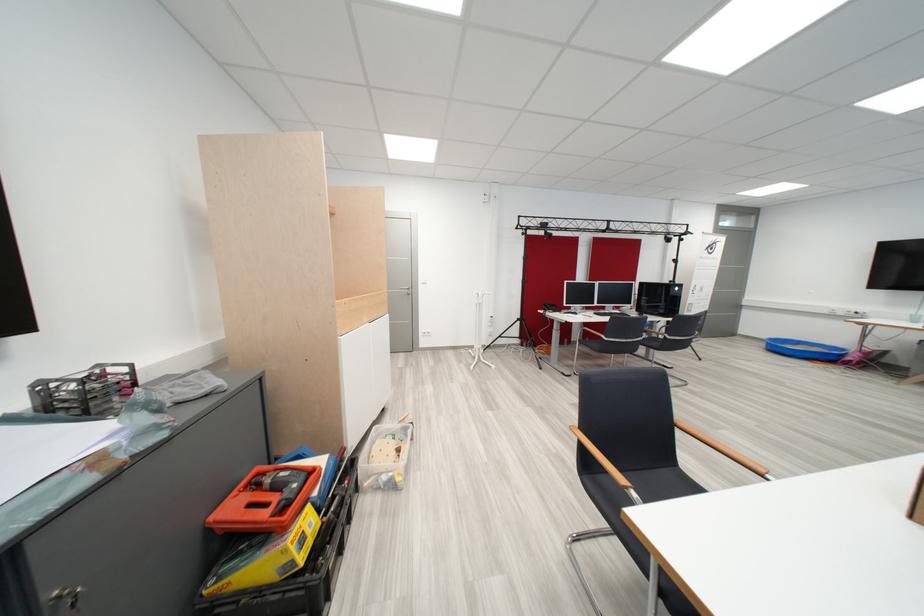
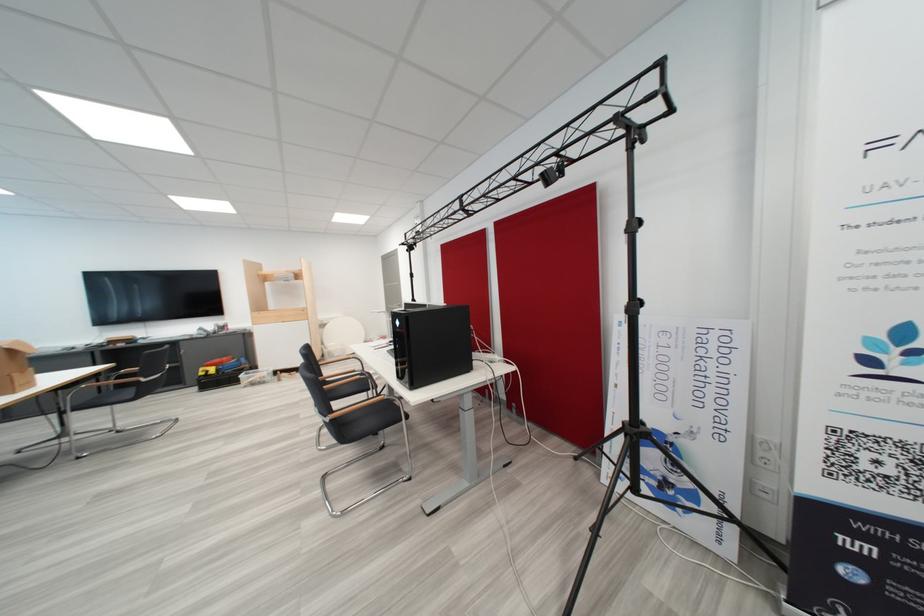
In the second image, find the point that corresponds to point (687, 291) in the first image.

(407, 325)